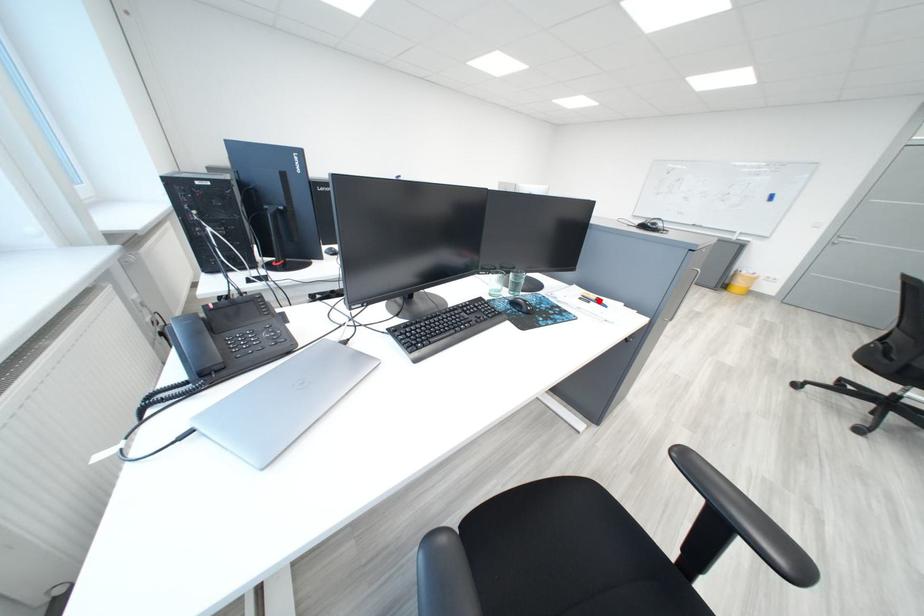
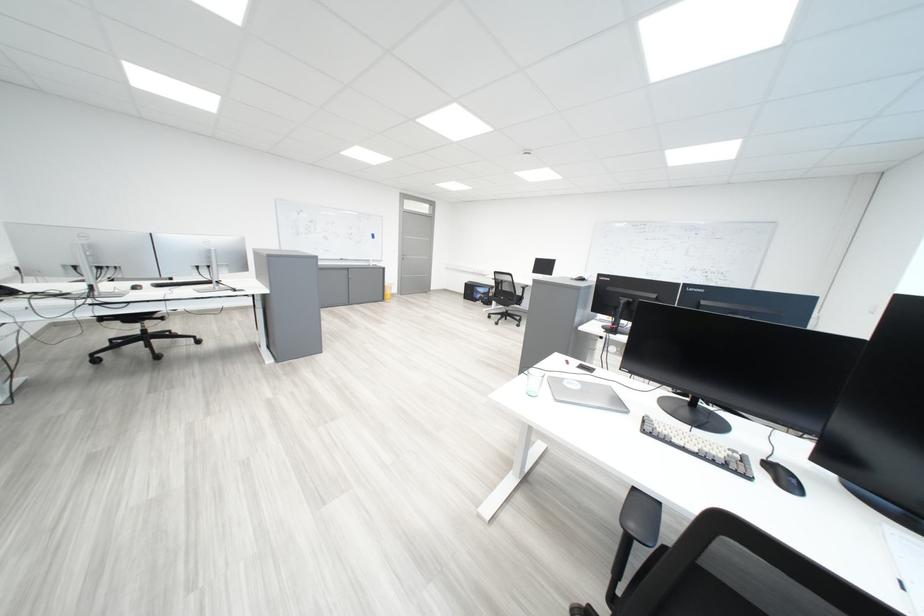
Question: I am providing you with two images of the same scene from different viewpoints. A red point is marked on the first image. Can you still see the location of the red point in image 2?

Choices:
 (A) Yes
 (B) No

Answer: (B)